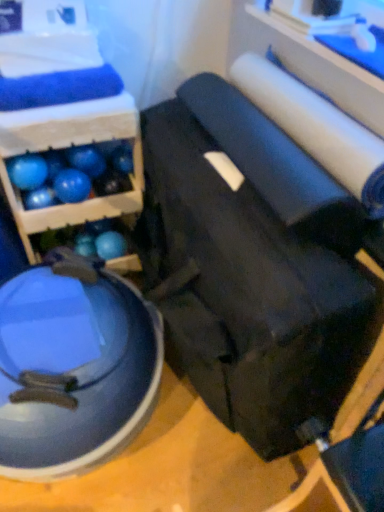
This screenshot has width=384, height=512. What do you see at coordinates (87, 160) in the screenshot?
I see `blue rubber ball at center-left, the fourth ball from the left` at bounding box center [87, 160].

Describe the element at coordinates (73, 367) in the screenshot. I see `glossy blue exercise ball at lower left, which appears as the 1th swivel chair when viewed from the left` at that location.

Describe the element at coordinates (316, 128) in the screenshot. I see `white matte toilet paper at upper right` at that location.

Consider the image. How much space does blue rubber ball at lower left, placed as the 4th ball when sorted from right to left, occupy vertically?

blue rubber ball at lower left, placed as the 4th ball when sorted from right to left, is 2.29 inches tall.

This screenshot has width=384, height=512. Identify the location of blue rubber ball at center, which is the 5th ball in left-to-right order. (122, 159).

I want to click on blue rubber ball at center-left, the fourth ball from the left, so click(x=87, y=160).

Is white matte toilet paper at upper right aimed at black leather swivel chair at center, positioned as the first swivel chair in right-to-left order?

No, white matte toilet paper at upper right is not aimed at black leather swivel chair at center, positioned as the first swivel chair in right-to-left order.

Which is more to the right, white matte toilet paper at upper right or black leather swivel chair at center, positioned as the first swivel chair in right-to-left order?

Positioned to the right is white matte toilet paper at upper right.

Is white matte toilet paper at upper right shorter than black leather swivel chair at center, acting as the 2th swivel chair starting from the left?

Correct, white matte toilet paper at upper right is not as tall as black leather swivel chair at center, acting as the 2th swivel chair starting from the left.

Is white matte toilet paper at upper right wider or thinner than black leather swivel chair at center, acting as the 2th swivel chair starting from the left?

Considering their sizes, white matte toilet paper at upper right looks slimmer than black leather swivel chair at center, acting as the 2th swivel chair starting from the left.

From the image's perspective, count 1st swivel chairs downward from the blue matte wood shelf at upper left and point to it. Please provide its 2D coordinates.

[(248, 293)]

Who is smaller, blue matte wood shelf at upper left or black leather swivel chair at center, acting as the 2th swivel chair starting from the left?

With smaller size is blue matte wood shelf at upper left.

From the image's perspective, is blue matte wood shelf at upper left positioned above or below black leather swivel chair at center, acting as the 2th swivel chair starting from the left?

blue matte wood shelf at upper left is above black leather swivel chair at center, acting as the 2th swivel chair starting from the left.

Which object is positioned more to the left, blue matte wood shelf at upper left or black leather swivel chair at center, acting as the 2th swivel chair starting from the left?

blue matte wood shelf at upper left.

Which of these two, blue matte wood shelf at upper left or glossy blue exercise ball at lower left, which appears as the 1th swivel chair when viewed from the left, is thinner?

With smaller width is blue matte wood shelf at upper left.

Considering the sizes of objects blue matte wood shelf at upper left and glossy blue exercise ball at lower left, which appears as the 1th swivel chair when viewed from the left, in the image provided, who is shorter, blue matte wood shelf at upper left or glossy blue exercise ball at lower left, which appears as the 1th swivel chair when viewed from the left,?

glossy blue exercise ball at lower left, which appears as the 1th swivel chair when viewed from the left.

From the image's perspective, which one is positioned lower, blue matte wood shelf at upper left or glossy blue exercise ball at lower left, which appears as the 1th swivel chair when viewed from the left?

glossy blue exercise ball at lower left, which appears as the 1th swivel chair when viewed from the left, from the image's perspective.

Is point (9, 185) less distant than point (132, 400)?

No, (9, 185) is behind (132, 400).

Is blue rubber ball at lower left, placed as the 4th ball when sorted from right to left, a part of glossy blue exercise ball at lower left, which appears as the 1th swivel chair when viewed from the left?

No, glossy blue exercise ball at lower left, which appears as the 1th swivel chair when viewed from the left, does not contain blue rubber ball at lower left, placed as the 4th ball when sorted from right to left.

From a real-world perspective, is glossy blue exercise ball at lower left, the second swivel chair in the right-to-left sequence, physically below blue rubber ball at lower left, placed as the 4th ball when sorted from right to left?

Yes, from a real-world perspective, glossy blue exercise ball at lower left, the second swivel chair in the right-to-left sequence, is below blue rubber ball at lower left, placed as the 4th ball when sorted from right to left.

Are glossy blue exercise ball at lower left, which appears as the 1th swivel chair when viewed from the left, and blue rubber ball at lower left, placed as the 4th ball when sorted from right to left, located far from each other?

No.

Can you confirm if blue rubber ball at upper left, arranged as the 5th ball when viewed from the right, is positioned to the left of blue rubber ball at upper left, the third ball when ordered from left to right?

Indeed, blue rubber ball at upper left, arranged as the 5th ball when viewed from the right, is positioned on the left side of blue rubber ball at upper left, the third ball when ordered from left to right.

How many degrees apart are the facing directions of blue rubber ball at upper left, arranged as the 5th ball when viewed from the right, and blue rubber ball at upper left, the third ball when ordered from left to right?

blue rubber ball at upper left, arranged as the 5th ball when viewed from the right, and blue rubber ball at upper left, the third ball when ordered from left to right, are facing 0.000434 degrees away from each other.

Does blue rubber ball at upper left, arranged as the 5th ball when viewed from the right, touch blue rubber ball at upper left, marked as the 3th ball in a right-to-left arrangement?

Yes, blue rubber ball at upper left, arranged as the 5th ball when viewed from the right, is touching blue rubber ball at upper left, marked as the 3th ball in a right-to-left arrangement.

Which is behind, point (30, 160) or point (61, 190)?

Positioned behind is point (61, 190).

The width and height of the screenshot is (384, 512). I want to click on shelf that is in front of the blue rubber ball at center, acting as the 1th ball starting from the right, so click(67, 147).

Are blue rubber ball at center, acting as the 1th ball starting from the right, and blue matte wood shelf at upper left making contact?

→ No.

Is blue rubber ball at center, which is the 5th ball in left-to-right order, shorter than blue matte wood shelf at upper left?

Yes.

Would you say blue rubber ball at center, which is the 5th ball in left-to-right order, is a long distance from blue rubber ball at upper left, arranged as the 5th ball when viewed from the right?

No.

Can you confirm if blue rubber ball at center, acting as the 1th ball starting from the right, is bigger than blue rubber ball at upper left, the first ball when ordered from left to right?

Actually, blue rubber ball at center, acting as the 1th ball starting from the right, might be smaller than blue rubber ball at upper left, the first ball when ordered from left to right.

Which is less distant, (121, 169) or (47, 170)?

Point (121, 169) is positioned farther from the camera compared to point (47, 170).

Consider the image. In terms of width, does blue rubber ball at center, acting as the 1th ball starting from the right, look wider or thinner when compared to blue rubber ball at upper left, arranged as the 5th ball when viewed from the right?

In the image, blue rubber ball at center, acting as the 1th ball starting from the right, appears to be more narrow than blue rubber ball at upper left, arranged as the 5th ball when viewed from the right.

You are a GUI agent. You are given a task and a screenshot of the screen. Output one action in this format:
    pyautogui.click(x=<x>, y=<y>)
    Task: Click on the 1st swivel chair below the white matte toilet paper at upper right (from the image's perspective)
    
    Given the screenshot: What is the action you would take?
    pyautogui.click(x=248, y=293)

Which swivel chair is the 2nd one when counting from the right side of the blue matte wood shelf at upper left? Please provide its 2D coordinates.

[(248, 293)]

Which object lies nearer to the anchor point blue rubber ball at lower left, the 2th ball when ordered from left to right, blue rubber ball at upper left, arranged as the 5th ball when viewed from the right, or blue matte wood shelf at upper left?

blue rubber ball at upper left, arranged as the 5th ball when viewed from the right, lies closer to blue rubber ball at lower left, the 2th ball when ordered from left to right, than the other object.

Estimate the real-world distances between objects in this image. Which object is closer to blue rubber ball at upper left, the third ball when ordered from left to right, blue matte wood shelf at upper left or white matte toilet paper at upper right?

Among the two, blue matte wood shelf at upper left is located nearer to blue rubber ball at upper left, the third ball when ordered from left to right.

When comparing their distances from blue matte wood shelf at upper left, does blue rubber ball at upper left, arranged as the 5th ball when viewed from the right, or blue rubber ball at lower left, placed as the 4th ball when sorted from right to left, seem further?

blue rubber ball at lower left, placed as the 4th ball when sorted from right to left, is further to blue matte wood shelf at upper left.

Looking at the image, which one is located closer to white matte toilet paper at upper right, blue rubber ball at center, acting as the 1th ball starting from the right, or blue rubber ball at upper left, the first ball when ordered from left to right?

Among the two, blue rubber ball at center, acting as the 1th ball starting from the right, is located nearer to white matte toilet paper at upper right.

Estimate the real-world distances between objects in this image. Which object is further from white matte toilet paper at upper right, blue rubber ball at center-left, the fourth ball from the left, or black leather swivel chair at center, acting as the 2th swivel chair starting from the left?

blue rubber ball at center-left, the fourth ball from the left, is positioned further to the anchor white matte toilet paper at upper right.

Based on the photo, looking at the image, which one is located closer to blue rubber ball at center, acting as the 1th ball starting from the right, glossy blue exercise ball at lower left, which appears as the 1th swivel chair when viewed from the left, or black leather swivel chair at center, positioned as the first swivel chair in right-to-left order?

glossy blue exercise ball at lower left, which appears as the 1th swivel chair when viewed from the left.

Which object lies further to the anchor point blue rubber ball at center, which is the 5th ball in left-to-right order, blue rubber ball at lower left, placed as the 4th ball when sorted from right to left, or glossy blue exercise ball at lower left, which appears as the 1th swivel chair when viewed from the left?

glossy blue exercise ball at lower left, which appears as the 1th swivel chair when viewed from the left.

When comparing their distances from blue rubber ball at center, which is the 5th ball in left-to-right order, does blue rubber ball at lower left, the 2th ball when ordered from left to right, or blue rubber ball at upper left, marked as the 3th ball in a right-to-left arrangement, seem further?

Based on the image, blue rubber ball at lower left, the 2th ball when ordered from left to right, appears to be further to blue rubber ball at center, which is the 5th ball in left-to-right order.

I want to click on swivel chair situated between blue matte wood shelf at upper left and black leather swivel chair at center, positioned as the first swivel chair in right-to-left order, from left to right, so click(73, 367).

Locate an element on the screen. This screenshot has height=512, width=384. shelf between blue rubber ball at center, which is the 5th ball in left-to-right order, and glossy blue exercise ball at lower left, the second swivel chair in the right-to-left sequence, in the up-down direction is located at coordinates (67, 147).

Find the location of a particular element. swivel chair situated between blue rubber ball at upper left, arranged as the 5th ball when viewed from the right, and black leather swivel chair at center, acting as the 2th swivel chair starting from the left, from left to right is located at coordinates [x=73, y=367].

Find the location of `shelf between blue rubber ball at lower left, placed as the 4th ball when sorted from right to left, and white matte toilet paper at upper right, in the horizontal direction`. shelf between blue rubber ball at lower left, placed as the 4th ball when sorted from right to left, and white matte toilet paper at upper right, in the horizontal direction is located at coordinates (67, 147).